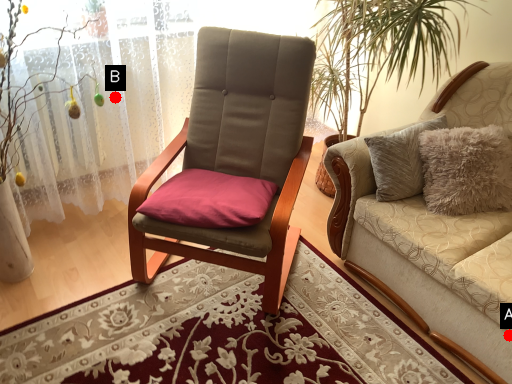
Question: Two points are circled on the image, labeled by A and B beside each circle. Which of the following is the farthest from the observer?

Choices:
 (A) A is further
 (B) B is further

Answer: (B)